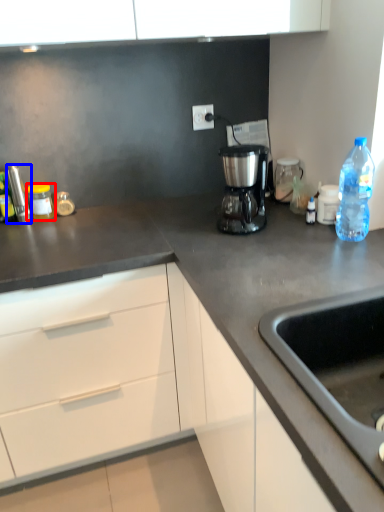
Question: Which object appears farthest to the camera in this image, kitchen appliance (highlighted by a red box) or appliance (highlighted by a blue box)?

Choices:
 (A) kitchen appliance
 (B) appliance

Answer: (A)